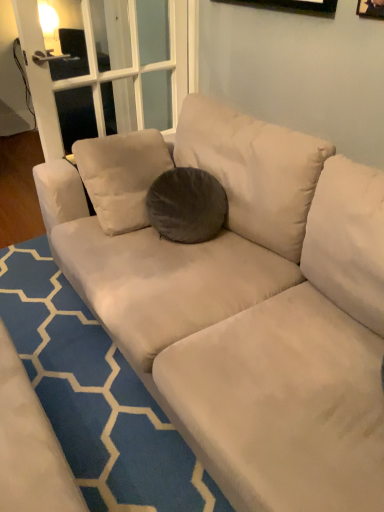
Question: From a real-world perspective, is blue textured rug at center positioned over dark gray velvety pillow at center based on gravity?

Choices:
 (A) no
 (B) yes

Answer: (A)

Question: Is blue textured rug at center thinner than dark gray velvety pillow at center?

Choices:
 (A) yes
 (B) no

Answer: (B)

Question: Considering the relative positions of blue textured rug at center and dark gray velvety pillow at center in the image provided, is blue textured rug at center to the left of dark gray velvety pillow at center from the viewer's perspective?

Choices:
 (A) no
 (B) yes

Answer: (B)

Question: Is blue textured rug at center smaller than dark gray velvety pillow at center?

Choices:
 (A) yes
 (B) no

Answer: (B)

Question: Would you say dark gray velvety pillow at center is part of blue textured rug at center's contents?

Choices:
 (A) no
 (B) yes

Answer: (A)

Question: In the image, is dark gray velvety pillow at center positioned in front of or behind wooden frame at upper right?

Choices:
 (A) front
 (B) behind

Answer: (B)

Question: Is point (170, 212) closer or farther from the camera than point (365, 16)?

Choices:
 (A) closer
 (B) farther

Answer: (B)

Question: Considering the positions of dark gray velvety pillow at center and wooden frame at upper right in the image, is dark gray velvety pillow at center taller or shorter than wooden frame at upper right?

Choices:
 (A) short
 (B) tall

Answer: (B)

Question: Based on their sizes in the image, would you say dark gray velvety pillow at center is bigger or smaller than wooden frame at upper right?

Choices:
 (A) small
 (B) big

Answer: (B)

Question: Looking at the image, does blue textured rug at center seem bigger or smaller compared to wooden frame at upper right?

Choices:
 (A) big
 (B) small

Answer: (A)

Question: From a real-world perspective, relative to wooden frame at upper right, is blue textured rug at center vertically above or below?

Choices:
 (A) below
 (B) above

Answer: (A)

Question: Is point (87, 463) positioned closer to the camera than point (370, 14)?

Choices:
 (A) closer
 (B) farther

Answer: (B)

Question: Is blue textured rug at center spatially inside wooden frame at upper right, or outside of it?

Choices:
 (A) outside
 (B) inside

Answer: (A)

Question: Considering the positions of point (382, 1) and point (155, 208), is point (382, 1) closer or farther from the camera than point (155, 208)?

Choices:
 (A) closer
 (B) farther

Answer: (A)

Question: Is wooden frame at upper right spatially inside dark gray velvety pillow at center, or outside of it?

Choices:
 (A) inside
 (B) outside

Answer: (B)